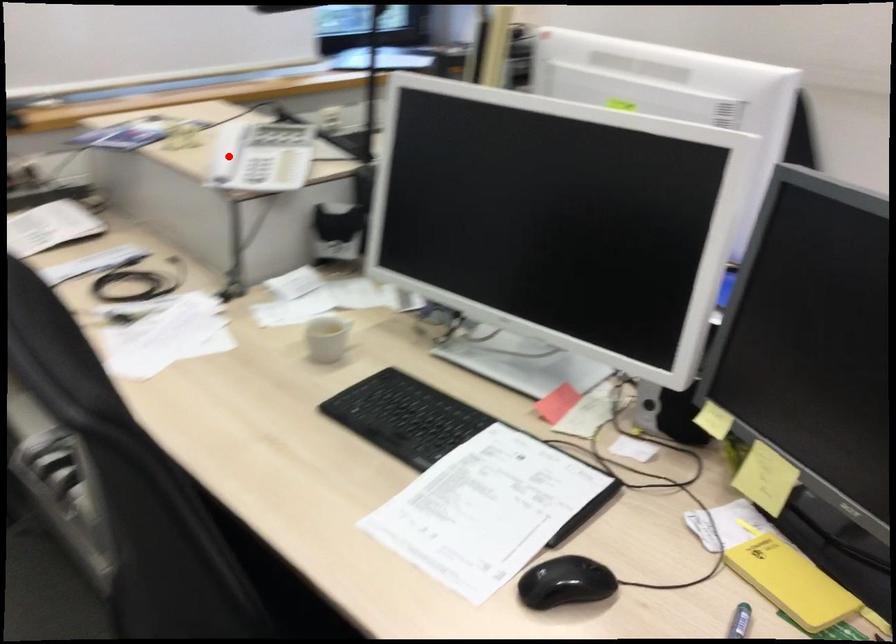
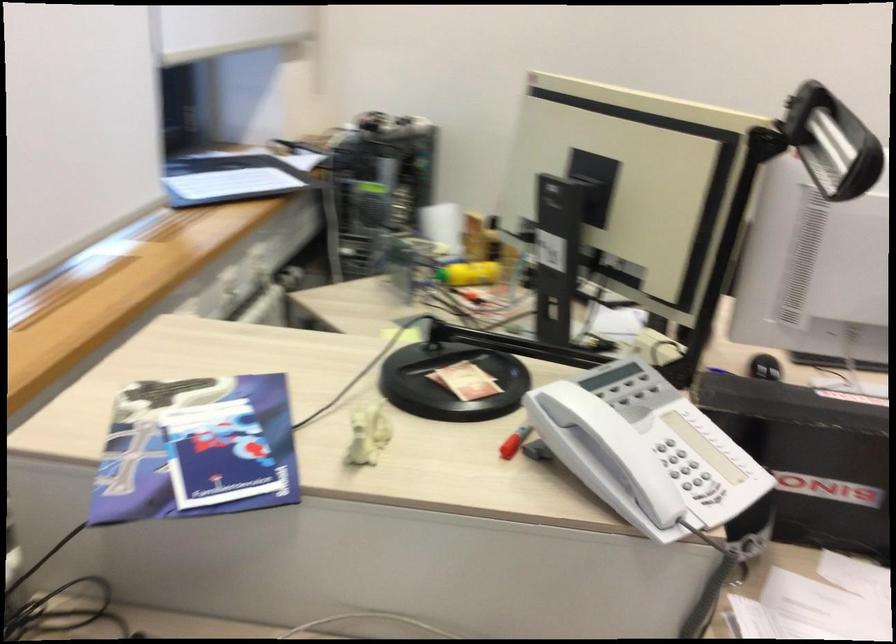
Question: I am providing you with two images of the same scene from different viewpoints. Image1 has a red point marked. In image2, the corresponding 3D location appears at what relative position? Reply with the corresponding letter.

Choices:
 (A) Closer
 (B) Farther

Answer: (A)